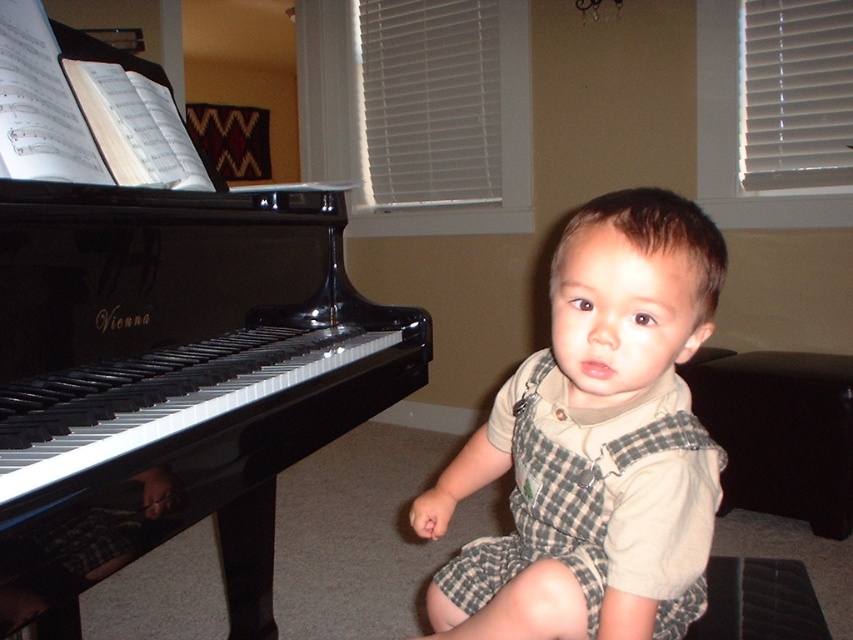
Between light beige plaid overalls at center and black leather stool at lower right, which one has less height?

black leather stool at lower right

I want to click on light beige plaid overalls at center, so click(x=595, y=444).

Is black glossy piano at left bigger than black leather stool at lower right?

Yes, black glossy piano at left is bigger than black leather stool at lower right.

Which is in front, point (372, 307) or point (787, 388)?

Point (372, 307) is more forward.

This screenshot has height=640, width=853. Identify the location of black glossy piano at left. (166, 348).

Find the location of a particular element. This screenshot has height=640, width=853. black glossy piano at left is located at coordinates (166, 348).

Identify the location of black glossy piano at left. The height and width of the screenshot is (640, 853). (166, 348).

Can you confirm if black glossy piano at left is positioned to the right of light beige plaid overalls at center?

In fact, black glossy piano at left is to the left of light beige plaid overalls at center.

This screenshot has height=640, width=853. What do you see at coordinates (166, 348) in the screenshot? I see `black glossy piano at left` at bounding box center [166, 348].

Identify the location of black glossy piano at left. 166,348.